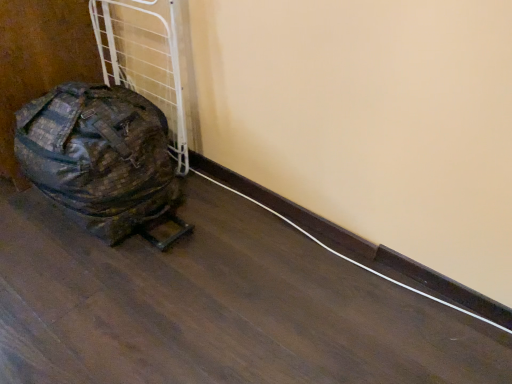
Question: Would you consider white cable at lower center to be distant from camouflage fabric bag at left?

Choices:
 (A) no
 (B) yes

Answer: (A)

Question: Are white cable at lower center and camouflage fabric bag at left making contact?

Choices:
 (A) no
 (B) yes

Answer: (A)

Question: Is white cable at lower center aimed at camouflage fabric bag at left?

Choices:
 (A) yes
 (B) no

Answer: (B)

Question: Is white cable at lower center to the right of camouflage fabric bag at left from the viewer's perspective?

Choices:
 (A) no
 (B) yes

Answer: (B)

Question: Is white cable at lower center taller than camouflage fabric bag at left?

Choices:
 (A) yes
 (B) no

Answer: (B)

Question: Is white cable at lower center looking in the opposite direction of camouflage fabric bag at left?

Choices:
 (A) yes
 (B) no

Answer: (B)

Question: Can you confirm if camouflage fabric bag at left is smaller than white cable at lower center?

Choices:
 (A) yes
 (B) no

Answer: (B)

Question: Can you confirm if camouflage fabric bag at left is wider than white cable at lower center?

Choices:
 (A) no
 (B) yes

Answer: (B)

Question: From the image's perspective, is camouflage fabric bag at left below white cable at lower center?

Choices:
 (A) yes
 (B) no

Answer: (B)

Question: From a real-world perspective, is camouflage fabric bag at left over white cable at lower center?

Choices:
 (A) no
 (B) yes

Answer: (B)

Question: Can you confirm if camouflage fabric bag at left is positioned to the right of white cable at lower center?

Choices:
 (A) no
 (B) yes

Answer: (A)

Question: Considering the relative sizes of camouflage fabric bag at left and white cable at lower center in the image provided, is camouflage fabric bag at left shorter than white cable at lower center?

Choices:
 (A) no
 (B) yes

Answer: (A)

Question: Looking at their shapes, would you say white cable at lower center is wider or thinner than camouflage fabric bag at left?

Choices:
 (A) wide
 (B) thin

Answer: (B)